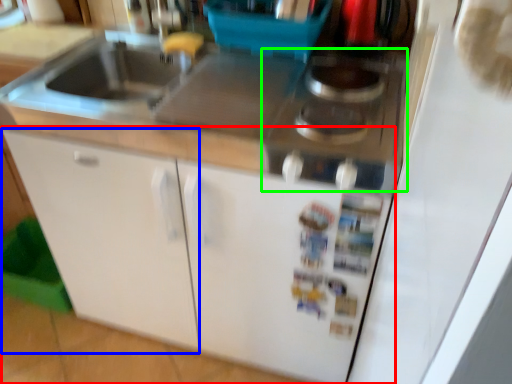
Question: Which object is positioned farthest from cabinetry (highlighted by a red box)? Select from cabinetry (highlighted by a blue box) and gas stove (highlighted by a green box).

Choices:
 (A) cabinetry
 (B) gas stove

Answer: (B)